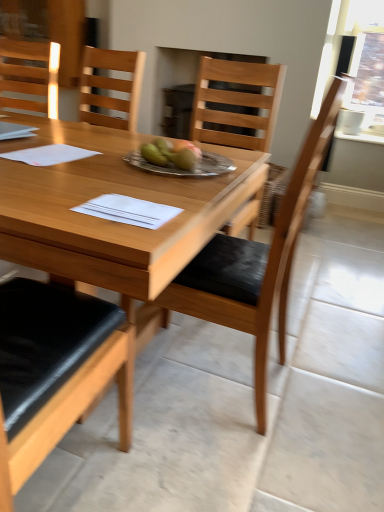
Question: Would you say wooden chair at center, the first chair ordered from the bottom, is inside or outside matte wood chair at upper left, which appears as the 2th chair when ordered from the bottom?

Choices:
 (A) inside
 (B) outside

Answer: (B)

Question: Is wooden chair at center, which appears as the 1th chair when viewed from the right, to the left or to the right of matte wood chair at upper left, the first chair viewed from the back, in the image?

Choices:
 (A) right
 (B) left

Answer: (A)

Question: Which object is the farthest from the wooden table at center?

Choices:
 (A) white paper at center
 (B) wooden chair at center, arranged as the 2th chair when viewed from the back
 (C) matte wood chair at upper left, placed as the first chair when sorted from top to bottom
 (D) silver metallic plate at center

Answer: (C)

Question: Estimate the real-world distances between objects in this image. Which object is closer to the wooden chair at center, marked as the second chair in a top-to-bottom arrangement?

Choices:
 (A) wooden table at center
 (B) white paper at center
 (C) matte wood chair at upper left, placed as the first chair when sorted from top to bottom
 (D) silver metallic plate at center

Answer: (D)